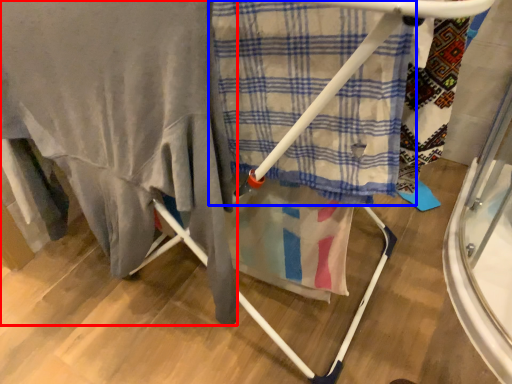
Question: Which of the following is the closest to the observer, blanket (highlighted by a red box) or cloth (highlighted by a blue box)?

Choices:
 (A) blanket
 (B) cloth

Answer: (A)